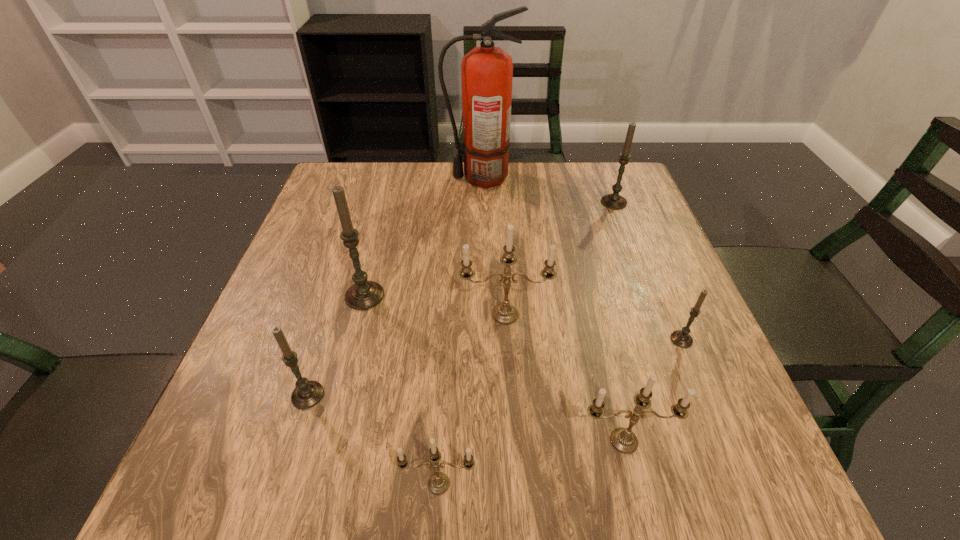
Identify the location of gray candle that is the closest one to the tallest object. This screenshot has width=960, height=540. [615, 201].

Identify which metallic candle is the second closest to the sixth farthest object. Please provide its 2D coordinates. Your answer should be formatted as a tuple, i.e. [(x, y)], where the tuple contains the x and y coordinates of a point satisfying the conditions above.

[(505, 313)]

This screenshot has width=960, height=540. In order to click on metallic candle that stands as the closest to the farthest object in this screenshot , I will do `click(505, 313)`.

What are the coordinates of `free location that satisfies the following two spatial constraints: 1. on the back side of the farthest gray candle; 2. on the right side of the farthest metallic candle` in the screenshot? It's located at (499, 202).

The height and width of the screenshot is (540, 960). I want to click on free location that satisfies the following two spatial constraints: 1. on the nozzle of the fire extinguisher; 2. on the back side of the farthest gray candle, so click(x=481, y=202).

This screenshot has height=540, width=960. What are the coordinates of `free space that satisfies the following two spatial constraints: 1. on the nozzle of the second nearest gray candle; 2. on the right side of the farthest object` in the screenshot? It's located at (482, 340).